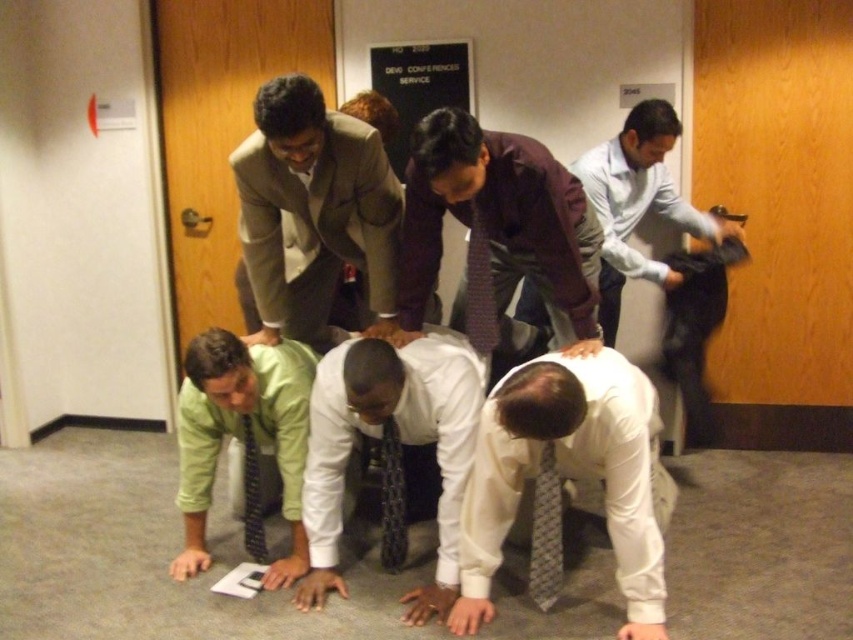
Question: Observing the image, what is the correct spatial positioning of matte brown suit at upper center in reference to white satin shirt at center?

Choices:
 (A) above
 (B) below

Answer: (A)

Question: Can you confirm if matte brown suit at upper center is positioned below gray patterned tie at lower center?

Choices:
 (A) yes
 (B) no

Answer: (B)

Question: Which object appears closest to the camera in this image?

Choices:
 (A) gray patterned tie at lower center
 (B) maroon textured shirt at center
 (C) white satin shirt at center
 (D) matte brown suit at upper center

Answer: (D)

Question: Does white textured shirt at lower center appear over white satin shirt at center?

Choices:
 (A) yes
 (B) no

Answer: (A)

Question: Which of the following is the closest to the observer?

Choices:
 (A) (537, 600)
 (B) (486, 257)
 (C) (238, 227)

Answer: (A)

Question: Which of the following is the farthest from the observer?

Choices:
 (A) white satin shirt at center
 (B) green matte shirt at lower left
 (C) gray patterned tie at lower center

Answer: (B)